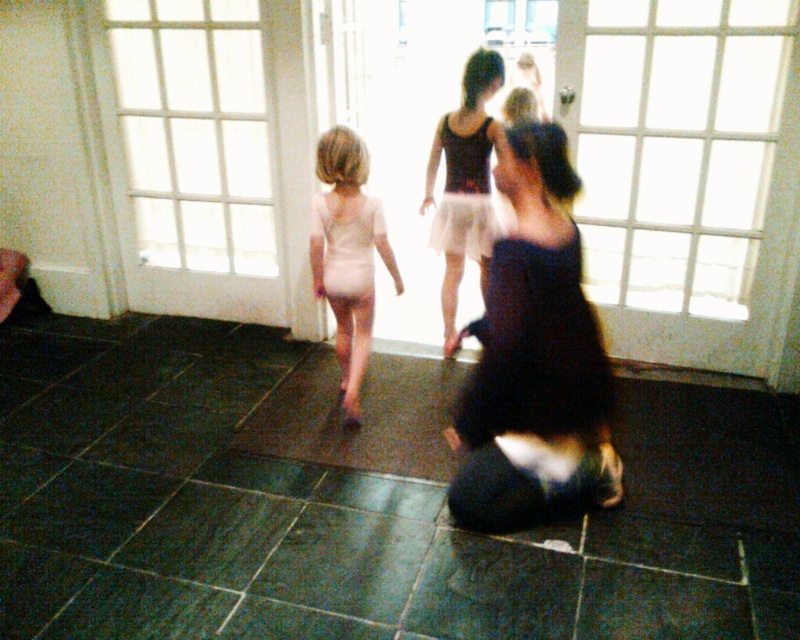
Which is more to the right, white matte leotard at center or white matte dress at center?

Positioned to the right is white matte dress at center.

Can you confirm if white matte leotard at center is bigger than white matte dress at center?

Correct, white matte leotard at center is larger in size than white matte dress at center.

Measure the distance between point (348, 396) and camera.

Point (348, 396) is 2.74 meters away from camera.

Where is `white matte leotard at center`? white matte leotard at center is located at coordinates (348, 253).

Looking at this image, between matte black leotard at center and white matte dress at center, which one appears on the left side from the viewer's perspective?

Positioned to the left is white matte dress at center.

Can you confirm if matte black leotard at center is positioned to the right of white matte dress at center?

Indeed, matte black leotard at center is positioned on the right side of white matte dress at center.

Is point (482, 221) farther from viewer compared to point (378, 224)?

Yes, it is behind point (378, 224).

The width and height of the screenshot is (800, 640). I want to click on matte black leotard at center, so click(464, 182).

Looking at this image, can you confirm if dark purple dress at center is smaller than matte black dress at center?

Actually, dark purple dress at center might be larger than matte black dress at center.

Who is more forward, (494, 342) or (482, 243)?

Point (494, 342) is in front.

Which is behind, point (578, 241) or point (480, 252)?

Positioned behind is point (480, 252).

Locate an element on the screen. dark purple dress at center is located at coordinates (534, 360).